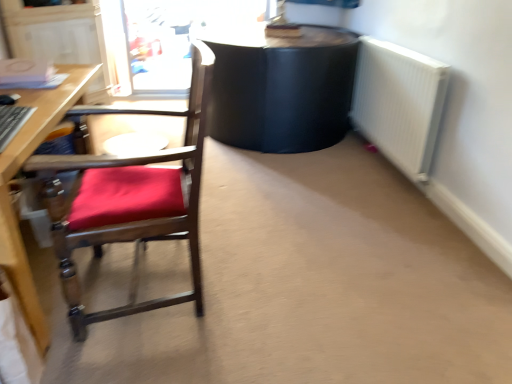
At what (x,y) coordinates should I click in order to perform the action: click on vacant space underneath white metallic radiator at right (from a real-world perspective). Please return your answer as a coordinate pair (x, y). Looking at the image, I should click on (390, 174).